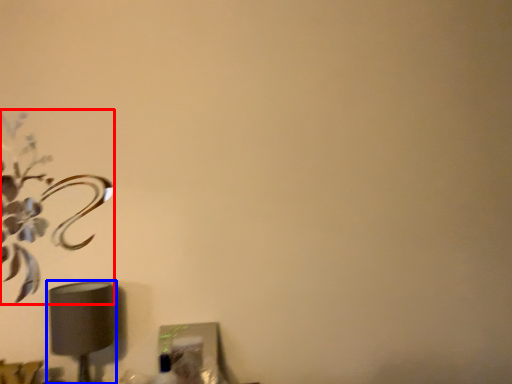
Question: Which point is further to the camera, flower (highlighted by a red box) or lamp (highlighted by a blue box)?

Choices:
 (A) flower
 (B) lamp

Answer: (A)